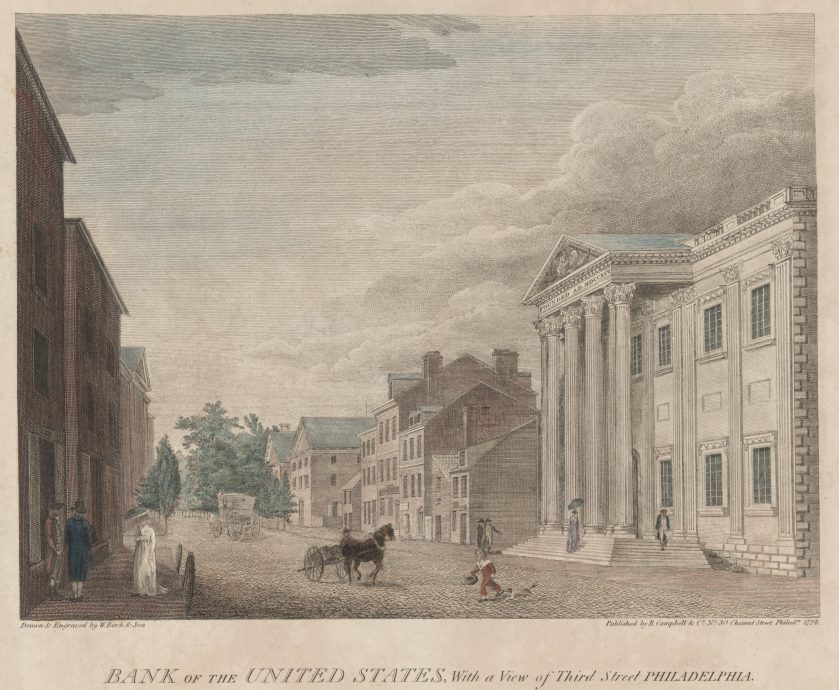
This screenshot has width=839, height=690. Find the location of `chimney`. chimney is located at coordinates (436, 373), (511, 357).